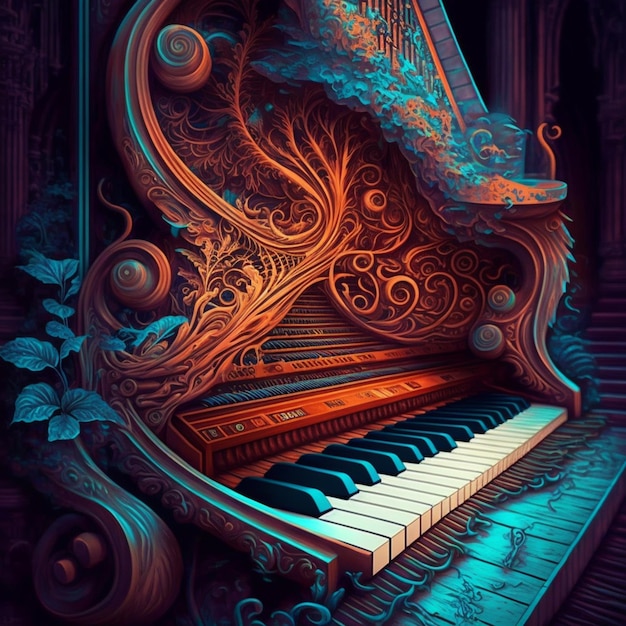
Identify the location of swirled, round piece of wood above the black keys on the right. Image resolution: width=626 pixels, height=626 pixels. (486, 342).